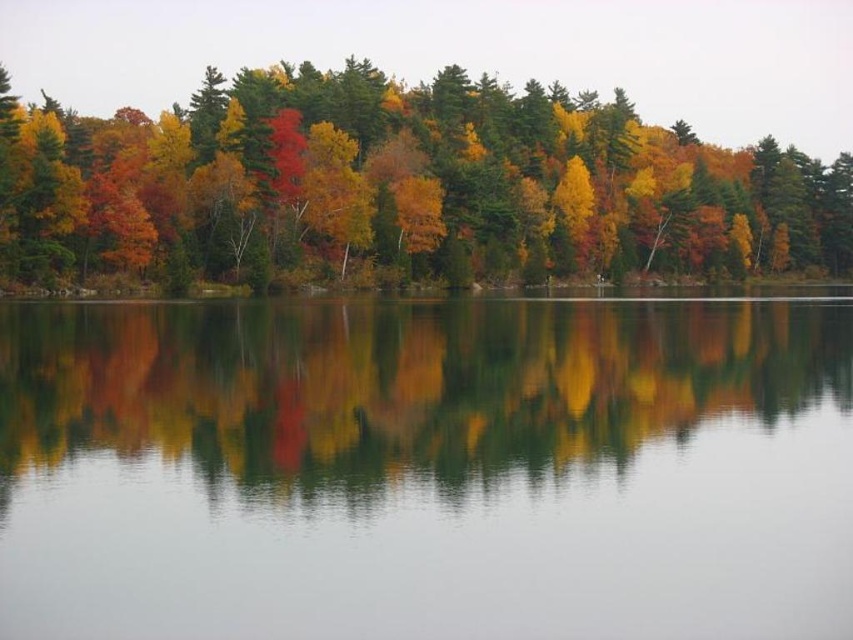
Based on the photo, can you confirm if smooth water at center is positioned to the left of autumn leaves at upper center?

Correct, you'll find smooth water at center to the left of autumn leaves at upper center.

Does point (502, 387) lie in front of point (505, 138)?

That is True.

Locate an element on the screen. smooth water at center is located at coordinates (426, 468).

You are a GUI agent. You are given a task and a screenshot of the screen. Output one action in this format:
    pyautogui.click(x=<x>, y=<y>)
    Task: Click on the smooth water at center
    The image size is (853, 640).
    Given the screenshot: What is the action you would take?
    pyautogui.click(x=426, y=468)